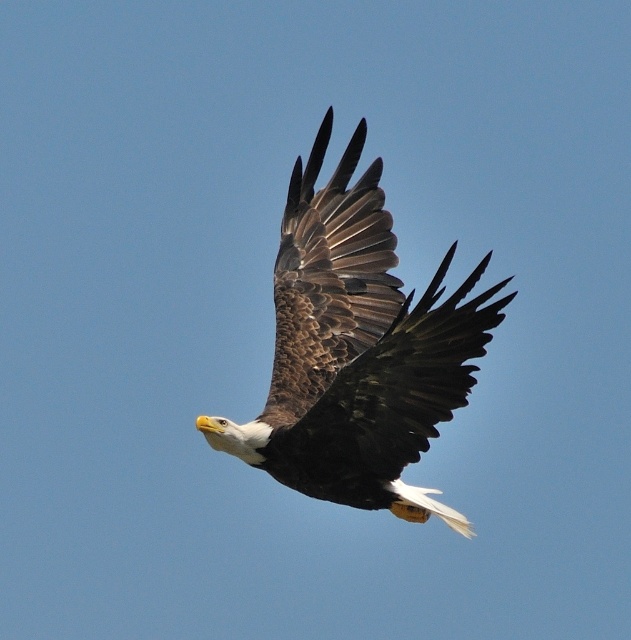
Looking at this image, you are a wildlife photographer trying to capture the bald eagle in flight. You notice two wings in the image. Which wing is shorter in height between the brown textured wing at center and the brown feathered wing at center?

The brown textured wing at center is shorter in height compared to the brown feathered wing at center.